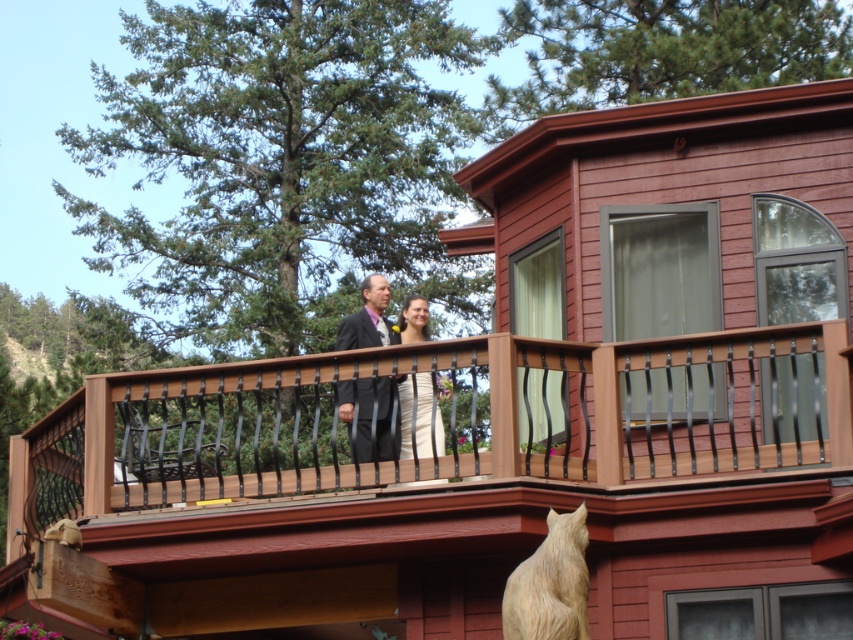
Based on the photo, you are a photographer trying to position a spotlight for a couple on a wooden balcony. The spotlight can only illuminate an area within a 0.5 radius from its center. If you place the spotlight at coordinates point 0.5, 0.5, will it cover the dark suit at center?

The dark suit at center is located at point (x=370, y=417). The distance between the spotlight at (x=426, y=320) and the dark suit is sqrt of squared differences in x and y coordinates. Calculating sqrt of squared 0.153 and 0.035 gives sqrt of 0.0234 and 0.0012, totaling sqrt of 0.0246 which is approximately 0.157. Since 0.157 is less than 0.5, the spotlight will cover the dark suit at center.

You are a photographer trying to position two markers on the balcony for a wedding photo shoot. The first marker is placed at point (367, 285) and the second at point (410, 426). Which marker is closer to the camera?

Point (367, 285) is further to the viewer than point (410, 426), so the second marker at point (410, 426) is closer to the camera.

You are a photographer setting up for a wedding photo shoot. You need to position yourself so that both the dark suit at center and the white satin dress at center are in focus. Which object should you focus on first to ensure both are sharp?

You should focus on the dark suit at center first since it is closer to you than the white satin dress at center, ensuring both will be in focus when using proper depth of field.